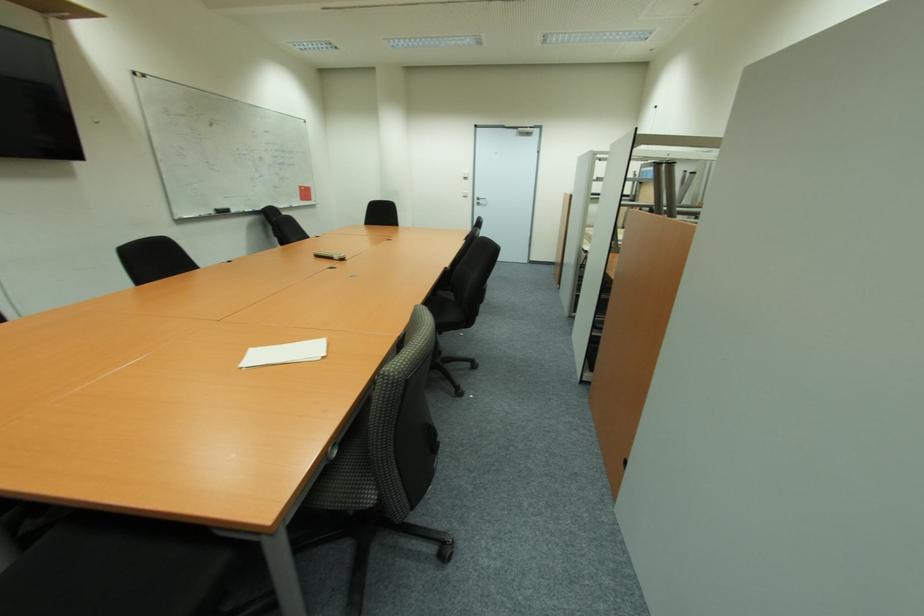
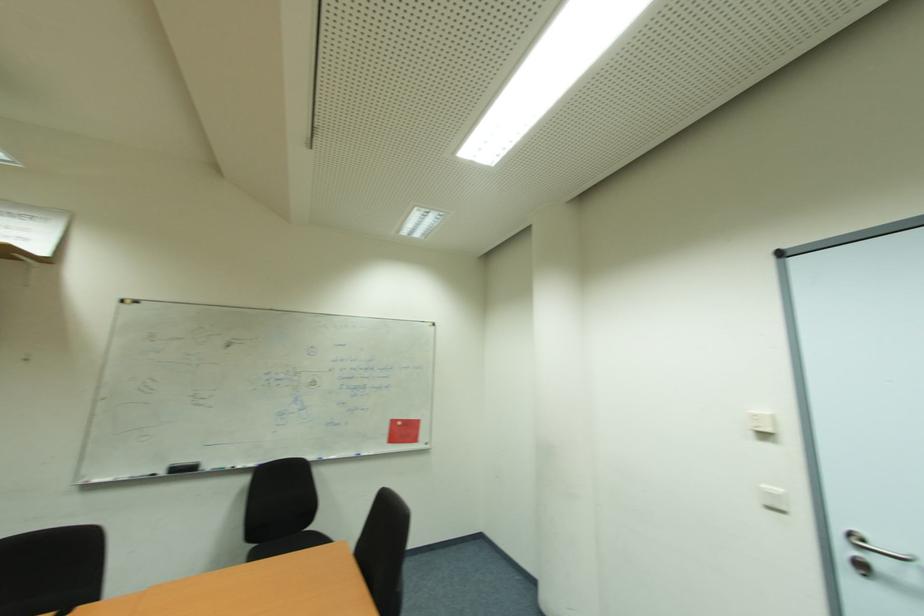
In the second image, find the point that corresponds to (x=470, y=172) in the first image.

(771, 414)